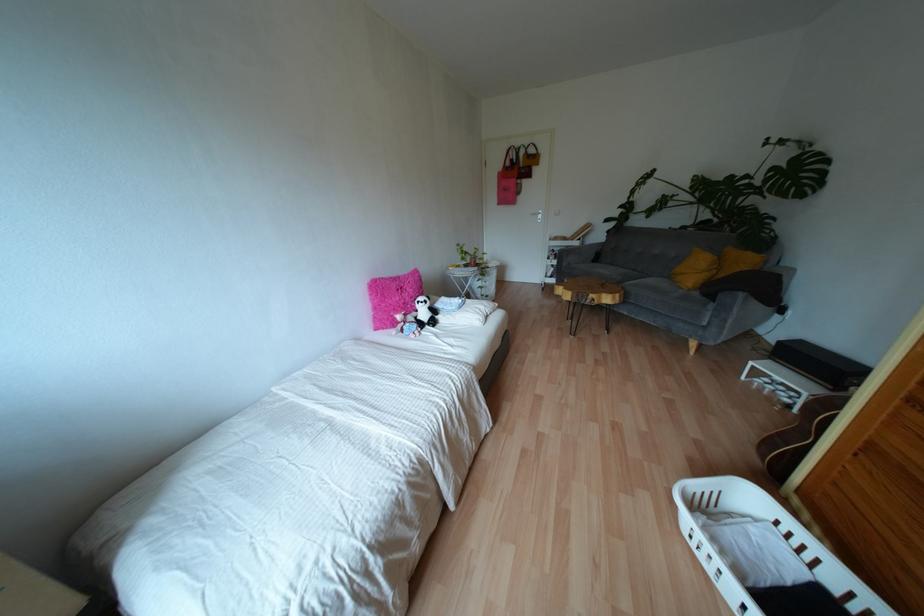
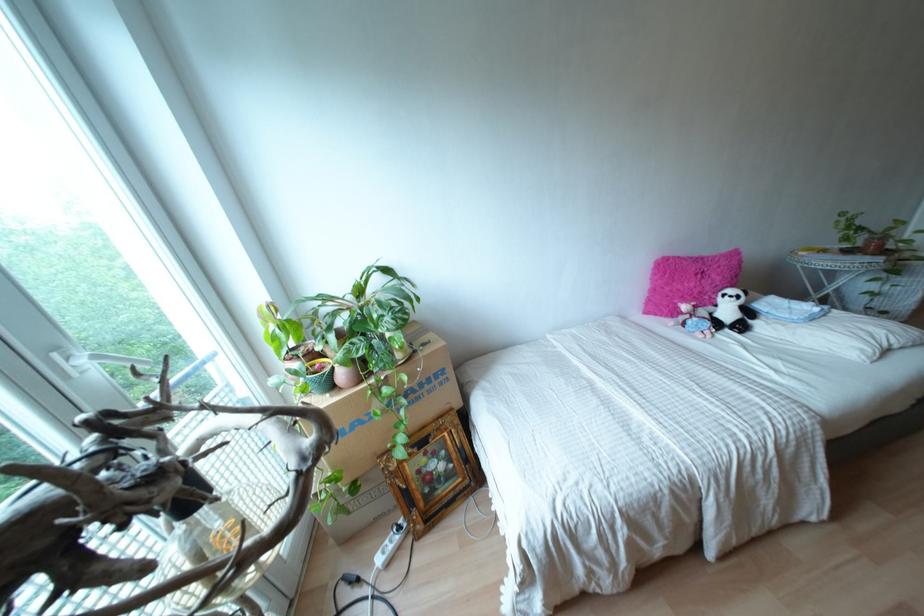
Locate, in the second image, the point that corresponds to point 412,313 in the first image.

(710, 308)